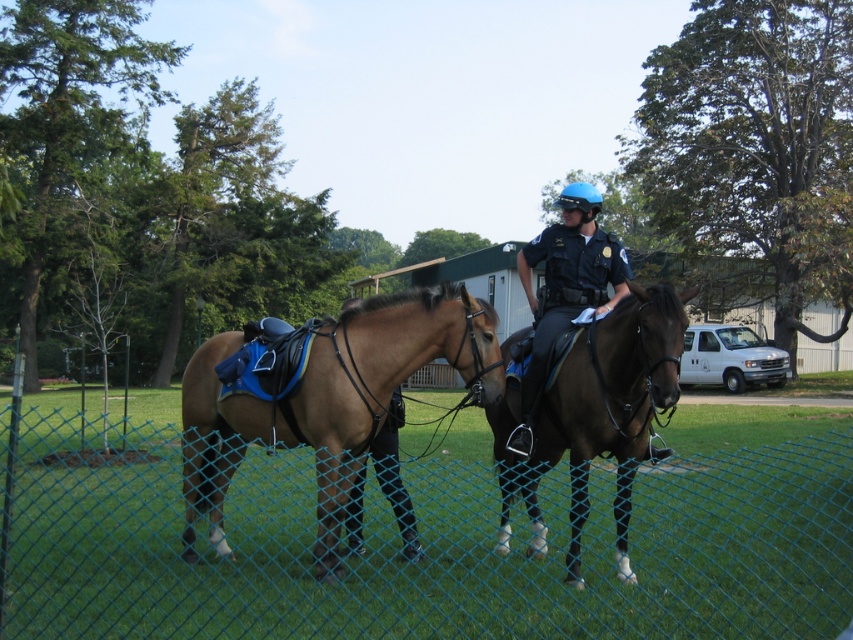
From the picture: Does green chain-link fence at lower center have a lesser height compared to brown leather saddle at center?

Indeed, green chain-link fence at lower center has a lesser height compared to brown leather saddle at center.

Is green chain-link fence at lower center thinner than brown leather saddle at center?

No.

Between point (233, 547) and point (193, 484), which one is positioned behind?

Point (233, 547)

This screenshot has height=640, width=853. I want to click on green chain-link fence at lower center, so click(444, 541).

Who is positioned more to the left, green chain-link fence at lower center or dark blue uniform at center?

green chain-link fence at lower center is more to the left.

Measure the distance between green chain-link fence at lower center and dark blue uniform at center.

They are 5.68 meters apart.

What are the coordinates of `green chain-link fence at lower center` in the screenshot? It's located at [444, 541].

Is green chain-link fence at lower center shorter than brown leather horse at center?

Yes, green chain-link fence at lower center is shorter than brown leather horse at center.

Who is more distant from viewer, (57, 502) or (602, 400)?

The point (57, 502) is more distant.

Is point (769, 449) farther from viewer compared to point (619, 408)?

Yes, point (769, 449) is farther from viewer.

This screenshot has height=640, width=853. Find the location of `green chain-link fence at lower center`. green chain-link fence at lower center is located at coordinates (444, 541).